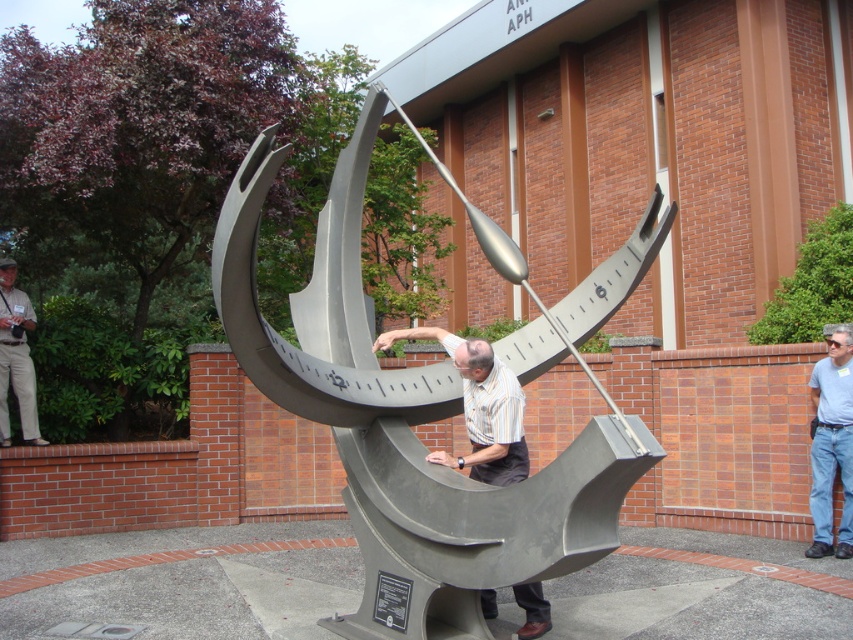
Question: Based on their relative distances, which object is farther from the light blue shirt at center?

Choices:
 (A) khaki pants at left
 (B) gray metallic sculpture at center
 (C) metallic gray sundial at center

Answer: (A)

Question: Is metallic gray sundial at center to the right of light blue shirt at center from the viewer's perspective?

Choices:
 (A) no
 (B) yes

Answer: (A)

Question: Does metallic gray sundial at center have a greater width compared to gray metallic sculpture at center?

Choices:
 (A) no
 (B) yes

Answer: (B)

Question: Which object is farther from the camera taking this photo?

Choices:
 (A) light blue shirt at center
 (B) khaki pants at left

Answer: (B)

Question: From the image, what is the correct spatial relationship of metallic gray sundial at center in relation to light blue shirt at center?

Choices:
 (A) above
 (B) below

Answer: (A)

Question: Which object appears farthest from the camera in this image?

Choices:
 (A) khaki pants at left
 (B) light blue shirt at center
 (C) metallic gray sundial at center
 (D) gray metallic sculpture at center

Answer: (A)